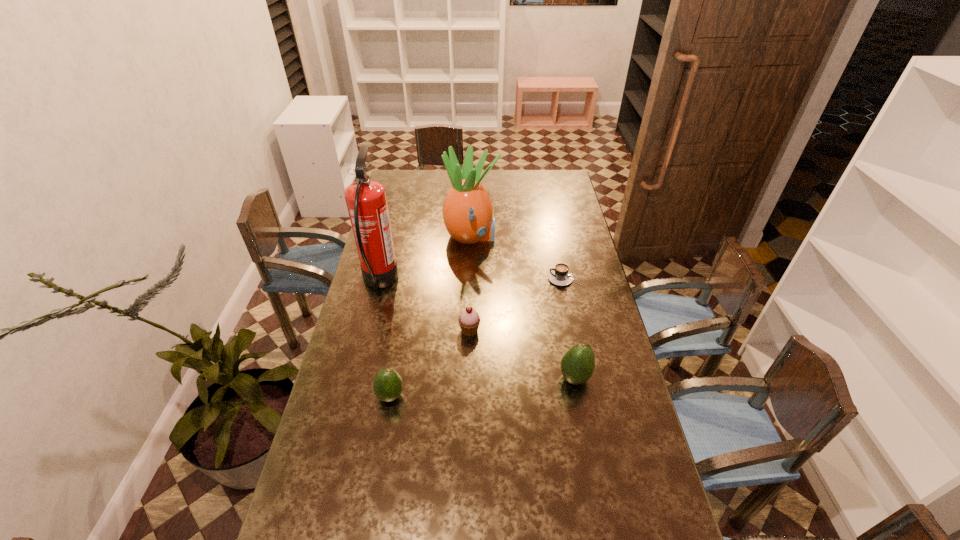
Locate an element on the screen. This screenshot has height=540, width=960. free space located on the right of the left avocado is located at coordinates (526, 396).

Find the location of `free space located 0.390m on the left of the right avocado`. free space located 0.390m on the left of the right avocado is located at coordinates (435, 377).

This screenshot has height=540, width=960. What are the coordinates of `vacant space situated 0.290m at the entrance of the pineapple` in the screenshot? It's located at (564, 237).

Locate an element on the screen. free space located with the handle on the side of the shortest object is located at coordinates (487, 279).

Where is `free region located with the handle on the side of the shortest object`? The image size is (960, 540). free region located with the handle on the side of the shortest object is located at coordinates (530, 279).

Find the location of a particular element. Image resolution: width=960 pixels, height=540 pixels. free region located with the handle on the side of the shortest object is located at coordinates (469, 279).

Where is `vacant position located 0.080m on the front of the third nearest object`? This screenshot has height=540, width=960. vacant position located 0.080m on the front of the third nearest object is located at coordinates (469, 357).

Identify the location of free location located 0.250m on the front-facing side of the tallest object. (462, 281).

At what (x,y) coordinates should I click in order to perform the action: click on avocado located in the left edge section of the desktop. Please return your answer as a coordinate pair (x, y). This screenshot has height=540, width=960. Looking at the image, I should click on (387, 386).

At what (x,y) coordinates should I click in order to perform the action: click on fire extinguisher that is at the left edge. Please return your answer as a coordinate pair (x, y). This screenshot has height=540, width=960. Looking at the image, I should click on point(366,201).